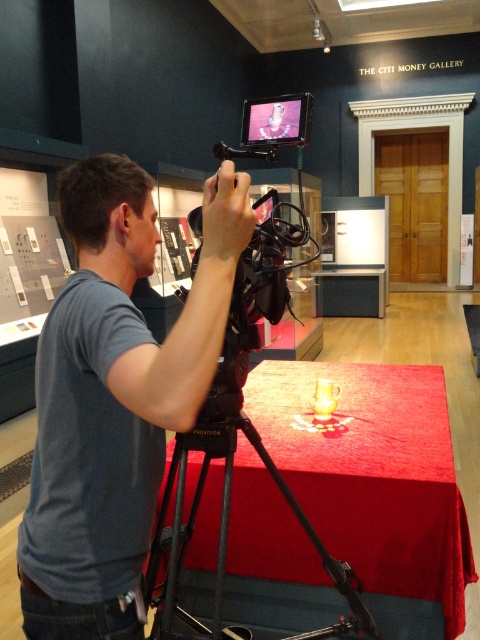
Question: Which point appears closest to the camera in this image?

Choices:
 (A) (408, 534)
 (B) (29, 563)

Answer: (B)

Question: Considering the relative positions of blue cotton shirt at center and shiny red fabric at center in the image provided, where is blue cotton shirt at center located with respect to shiny red fabric at center?

Choices:
 (A) below
 (B) above

Answer: (B)

Question: Can you confirm if blue cotton shirt at center is positioned to the left of shiny red fabric at center?

Choices:
 (A) yes
 (B) no

Answer: (A)

Question: Is blue cotton shirt at center closer to the viewer compared to shiny red fabric at center?

Choices:
 (A) no
 (B) yes

Answer: (B)

Question: Which of the following is the closest to the observer?

Choices:
 (A) (357, 556)
 (B) (242, 189)

Answer: (B)

Question: Which point is closer to the camera taking this photo?

Choices:
 (A) (457, 540)
 (B) (122, 195)

Answer: (B)